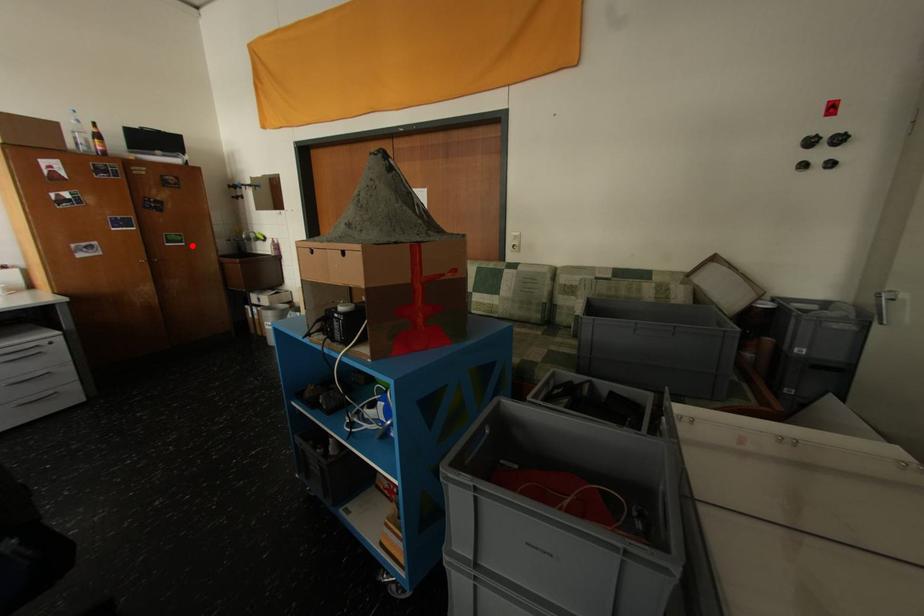
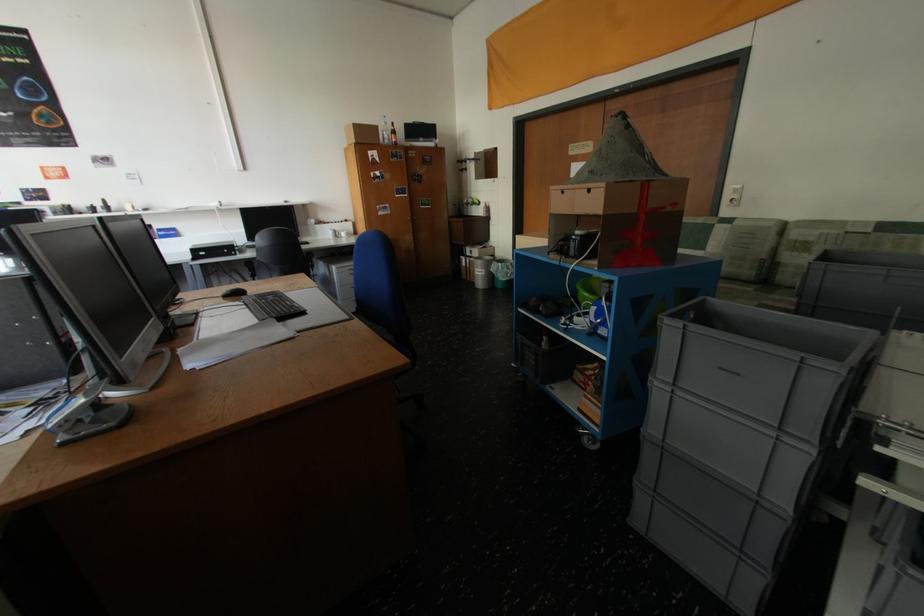
Where in the second image is the point corresponding to the highlighted location from the first image?

(439, 208)